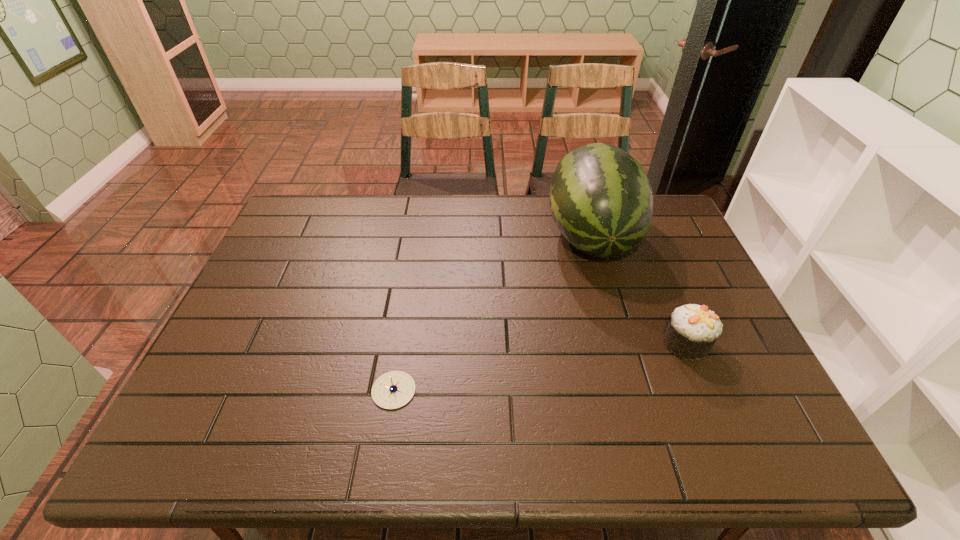
Identify the location of watermelon located in the right edge section of the desktop. (601, 199).

Where is `cupcake situated at the right edge`? cupcake situated at the right edge is located at coordinates (693, 329).

At what (x,y) coordinates should I click in order to perform the action: click on object located in the far right corner section of the desktop. Please return your answer as a coordinate pair (x, y). The width and height of the screenshot is (960, 540). Looking at the image, I should click on [x=601, y=199].

In the image, there is a desktop. Where is `vacant region at the far edge`? The height and width of the screenshot is (540, 960). vacant region at the far edge is located at coordinates (531, 195).

Locate an element on the screen. The width and height of the screenshot is (960, 540). vacant space at the near edge is located at coordinates (407, 450).

Locate an element on the screen. vacant space at the left edge of the desktop is located at coordinates (227, 363).

In the image, there is a desktop. Where is `vacant space at the right edge`? vacant space at the right edge is located at coordinates (734, 343).

This screenshot has height=540, width=960. What are the coordinates of `vacant position at the far left corner of the desktop` in the screenshot? It's located at (322, 204).

This screenshot has width=960, height=540. Identify the location of blank region between the cupcake and the shortest object. (540, 367).

At what (x,y) coordinates should I click in order to perform the action: click on vacant space in between the leftmost object and the tallest object. Please return your answer as a coordinate pair (x, y). The width and height of the screenshot is (960, 540). Looking at the image, I should click on click(492, 313).